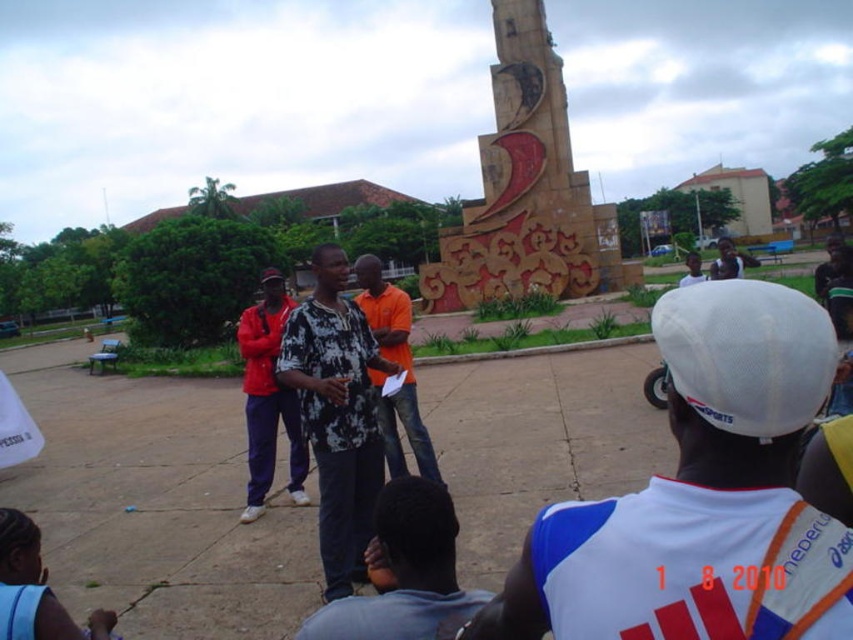
You are a photographer trying to capture a group photo of the two speakers at the public square. The camera you have can only focus on objects within a 15 cm width range. Given that the black printed shirt at center is thinner than the dark blue shirt at center, can you fit both speakers into the camera focus range?

The black printed shirt at center is thinner than the dark blue shirt at center, but the exact width difference isn not provided. Without knowing the specific widths, it is impossible to determine if their combined width falls within the 15 cm focus range. Additional measurements are needed.

You are standing at the origin point in the park. There is a black printed shirt at center represented by point [335,413]. Can you walk straight from your current position to reach the black printed shirt at center without any obstacles?

The black printed shirt at center is represented by point [335,413], so yes, you can walk straight from the origin point to reach it as there are no obstacles mentioned in the scene description.

You are organizing a photo shoot in the park and need to ensure that both the black printed shirt at center and the orange cotton shirt at center are visible in the frame. Given that the camera has a fixed focal length, which shirt should you position closer to the camera to maintain clarity and detail?

Since the black printed shirt at center is wider than the orange cotton shirt at center, positioning the orange cotton shirt at center closer to the camera would help maintain clarity and detail for both shirts. This is because objects closer to the camera appear larger in the frame, counteracting the width difference between the two shirts.